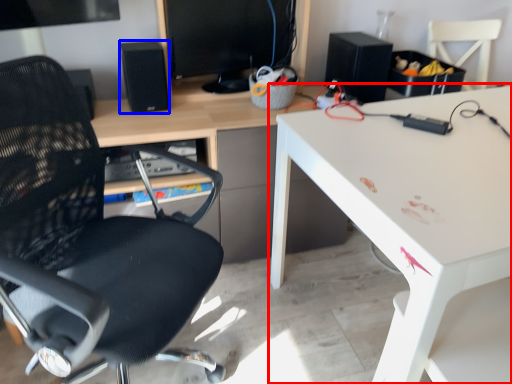
Question: Among these objects, which one is nearest to the camera, desk (highlighted by a red box) or speaker (highlighted by a blue box)?

Choices:
 (A) desk
 (B) speaker

Answer: (A)